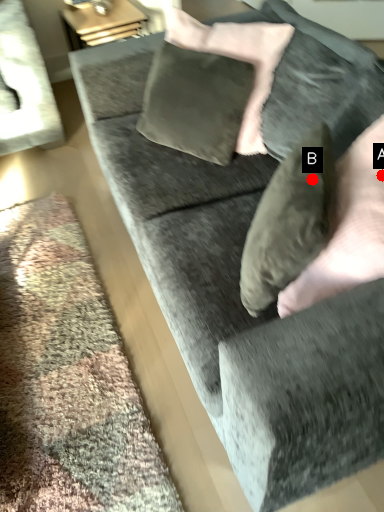
Question: Two points are circled on the image, labeled by A and B beside each circle. Which of the following is the closest to the observer?

Choices:
 (A) A is closer
 (B) B is closer

Answer: (B)